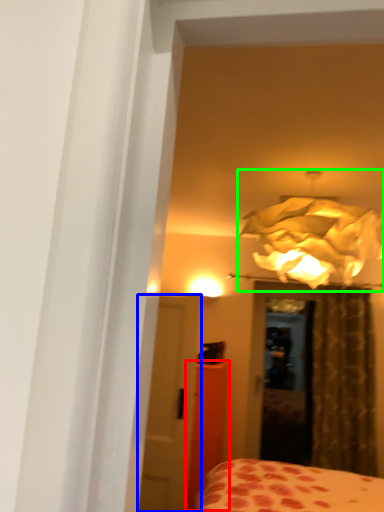
Question: Which object is positioned closest to armoire (highlighted by a red box)? Select from door (highlighted by a blue box) and lamp (highlighted by a green box).

Choices:
 (A) door
 (B) lamp

Answer: (A)